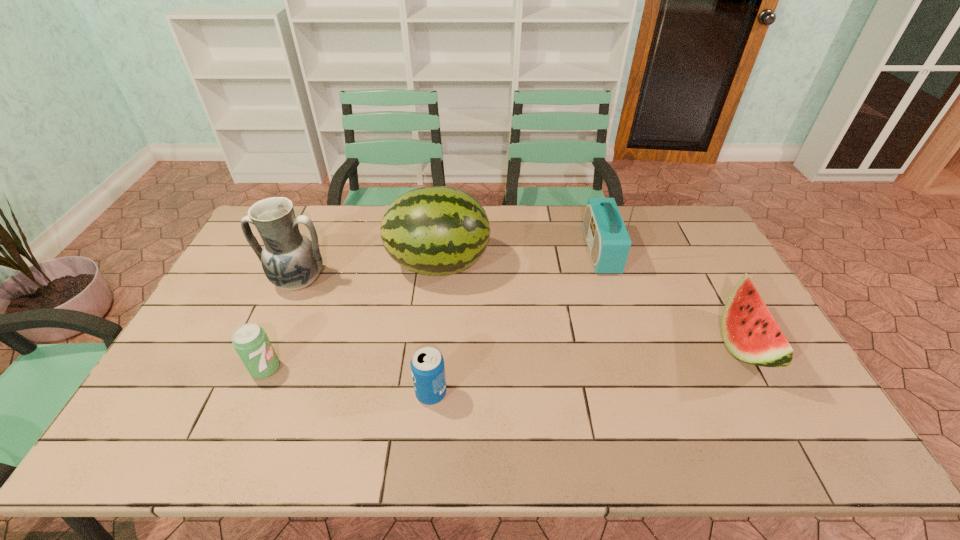
You are a GUI agent. You are given a task and a screenshot of the screen. Output one action in this format:
    pyautogui.click(x=<x>, y=<y>)
    Task: Click on the blank area located 0.270m on the front panel of the tallest object
    Image resolution: width=960 pixels, height=540 pixels.
    Given the screenshot: What is the action you would take?
    pyautogui.click(x=507, y=251)

Identify the location of free space located 0.230m on the front panel of the tallest object. The width and height of the screenshot is (960, 540). (518, 251).

Locate an element on the screen. The width and height of the screenshot is (960, 540). vacant point located on the front-facing side of the pitcher is located at coordinates (266, 356).

Find the location of `vacant area situated at the stem end of the left watermelon`. vacant area situated at the stem end of the left watermelon is located at coordinates (595, 264).

Image resolution: width=960 pixels, height=540 pixels. Find the location of `free spot located 0.230m on the outer rind of the nearer watermelon`. free spot located 0.230m on the outer rind of the nearer watermelon is located at coordinates point(638,345).

Where is `free region located on the outer rind of the nearer watermelon`? The width and height of the screenshot is (960, 540). free region located on the outer rind of the nearer watermelon is located at coordinates click(594, 345).

You are a GUI agent. You are given a task and a screenshot of the screen. Output one action in this format:
    pyautogui.click(x=<x>, y=<y>)
    Task: Click on the blank area located on the outer rind of the nearer watermelon
    
    Given the screenshot: What is the action you would take?
    pyautogui.click(x=641, y=345)

You are a GUI agent. You are given a task and a screenshot of the screen. Output one action in this format:
    pyautogui.click(x=<x>, y=<y>)
    Task: Click on the free space located on the back of the right soda
    The height and width of the screenshot is (540, 960).
    Given the screenshot: What is the action you would take?
    pyautogui.click(x=437, y=332)

This screenshot has height=540, width=960. Identify the location of vacant space situated 0.340m on the right of the left soda. (409, 368).

This screenshot has width=960, height=540. What are the coordinates of `radio receiver at the far edge` in the screenshot? It's located at (608, 241).